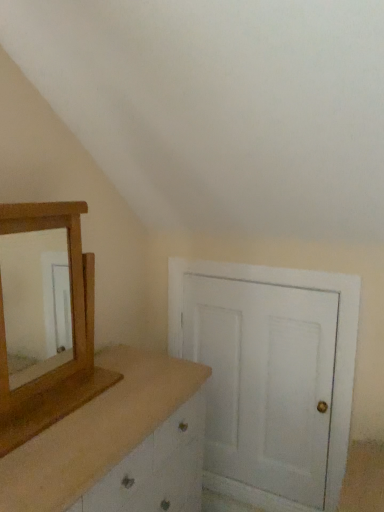
Question: Does point (69, 395) appear closer or farther from the camera than point (49, 437)?

Choices:
 (A) farther
 (B) closer

Answer: (A)

Question: Based on their sizes in the image, would you say wooden mirror at left is bigger or smaller than wooden dresser at left?

Choices:
 (A) small
 (B) big

Answer: (A)

Question: Estimate the real-world distances between objects in this image. Which object is farther from the wooden dresser at left?

Choices:
 (A) wooden mirror at left
 (B) white matte door at center

Answer: (B)

Question: Estimate the real-world distances between objects in this image. Which object is closer to the wooden mirror at left?

Choices:
 (A) wooden dresser at left
 (B) white matte door at center

Answer: (A)